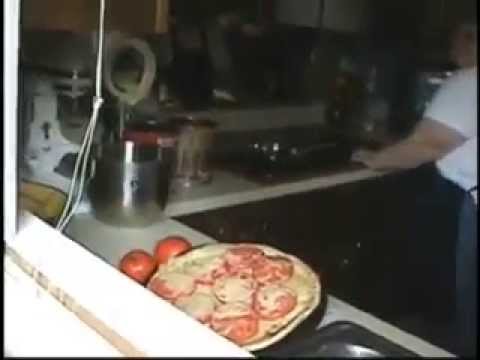
Where is `brightly lit white area`? brightly lit white area is located at coordinates (85, 269), (28, 305), (10, 156).